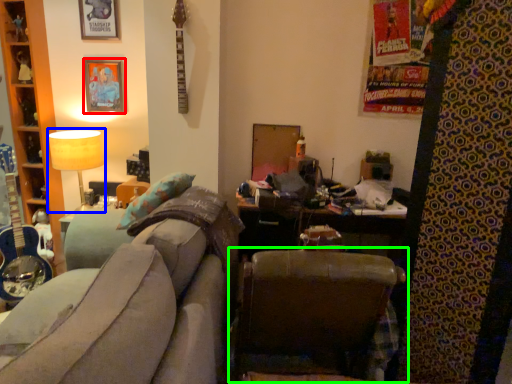
Question: Considering the real-world distances, which object is farthest from picture frame (highlighted by a red box)? table lamp (highlighted by a blue box) or chair (highlighted by a green box)?

Choices:
 (A) table lamp
 (B) chair

Answer: (B)